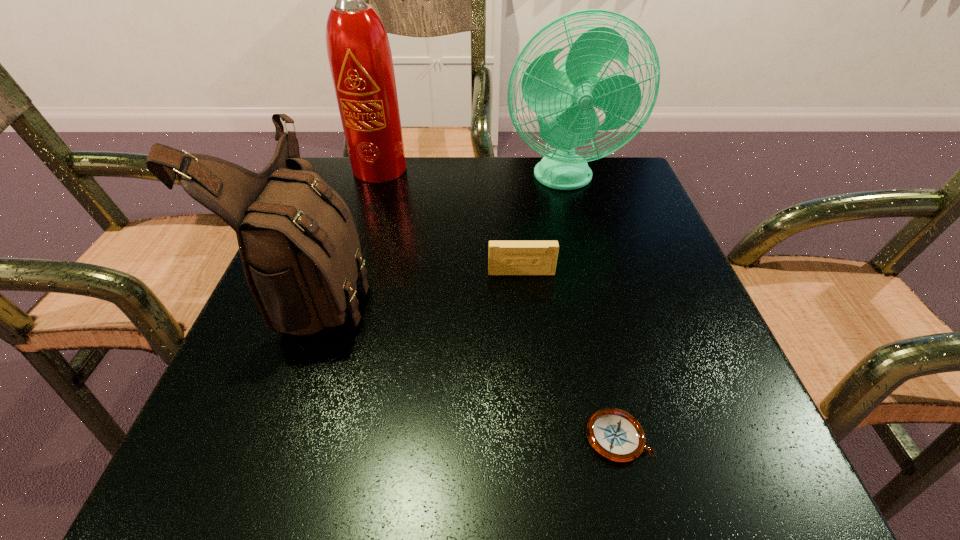
At what (x,y) coordinates should I click in order to perform the action: click on fire extinguisher. Please return your answer as a coordinate pair (x, y). The image size is (960, 540). Looking at the image, I should click on (359, 53).

Locate an element on the screen. fan is located at coordinates (568, 94).

Find the location of `shoulder bag`. shoulder bag is located at coordinates (299, 246).

The width and height of the screenshot is (960, 540). Identify the location of videotape. (504, 257).

Identify the location of the nearest object. (614, 434).

The height and width of the screenshot is (540, 960). Find the location of `the shortest object`. the shortest object is located at coordinates (614, 434).

At what (x,y) coordinates should I click in order to perform the action: click on blank space located 0.100m on the right of the fire extinguisher. Please return your answer as a coordinate pair (x, y). Looking at the image, I should click on 461,170.

At what (x,y) coordinates should I click in order to perform the action: click on vacant space located in front of the fan to blow air. Please return your answer as a coordinate pair (x, y). Looking at the image, I should click on (582, 248).

The height and width of the screenshot is (540, 960). What are the coordinates of `free point located 0.250m on the front-facing side of the shoulder bag` in the screenshot? It's located at (512, 284).

At what (x,y) coordinates should I click in order to perform the action: click on vacant region located at the front of the second shortest object with spools. Please return your answer as a coordinate pair (x, y). The image size is (960, 540). Looking at the image, I should click on (534, 405).